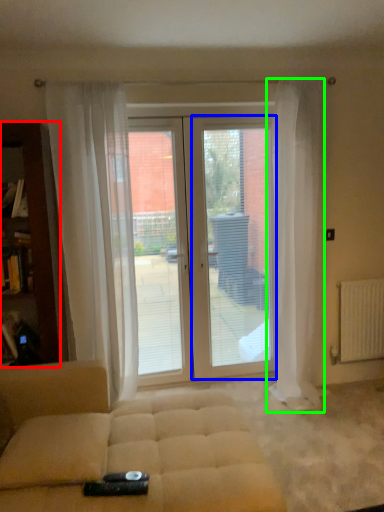
Question: Based on their relative distances, which object is farther from cabinetry (highlighted by a red box)? Choose from screen door (highlighted by a blue box) and curtain (highlighted by a green box).

Choices:
 (A) screen door
 (B) curtain

Answer: (B)